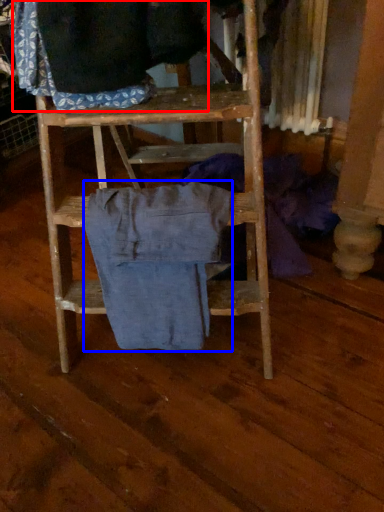
Question: Which of the following is the farthest to the observer, clothing (highlighted by a red box) or clothing (highlighted by a blue box)?

Choices:
 (A) clothing
 (B) clothing

Answer: (B)